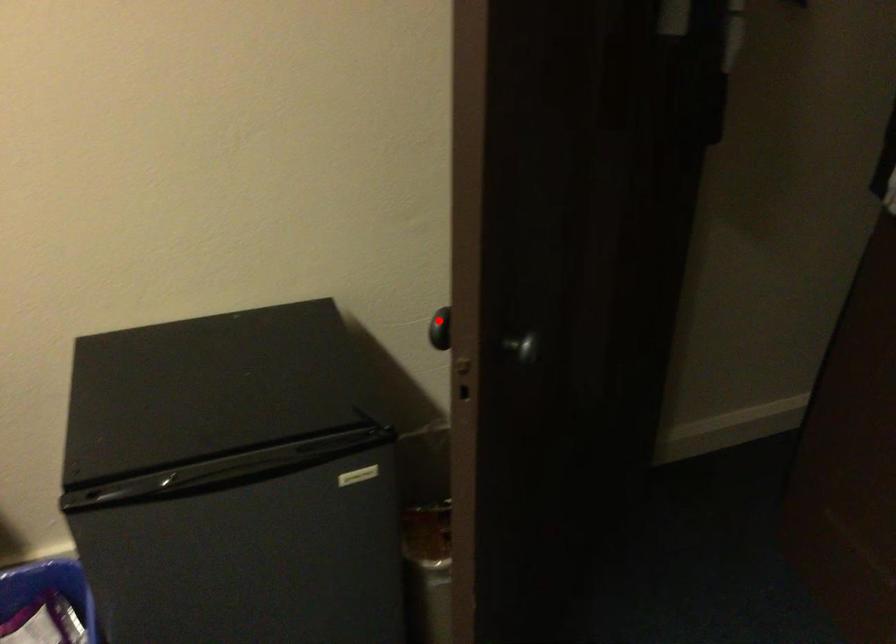
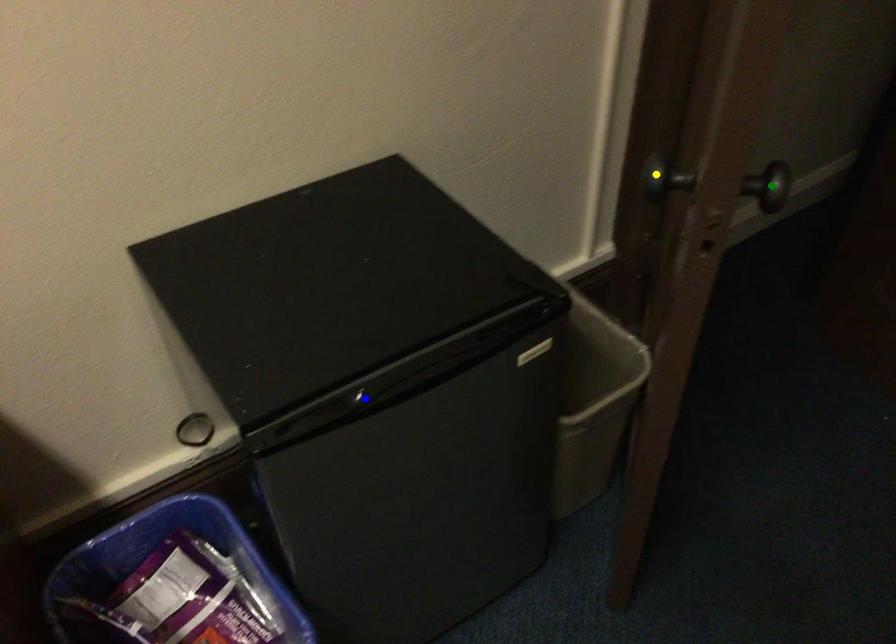
Question: I am providing you with two images of the same scene from different viewpoints. A red point is marked on the first image. You are given multiple points on the second image. Can you choose the point in image 2 that corresponds to the point in image 1?

Choices:
 (A) green point
 (B) yellow point
 (C) blue point

Answer: (B)